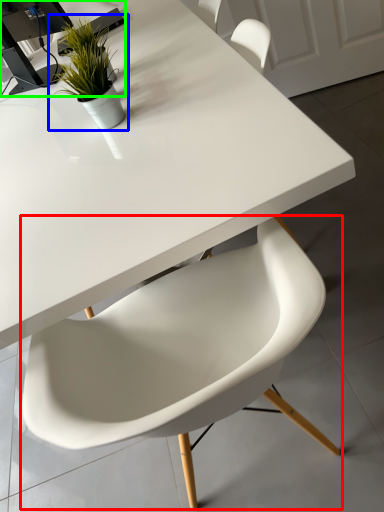
Question: Based on their relative distances, which object is nearer to chair (highlighted by a red box)? Choose from houseplant (highlighted by a blue box) and computer desk (highlighted by a green box).

Choices:
 (A) houseplant
 (B) computer desk

Answer: (A)